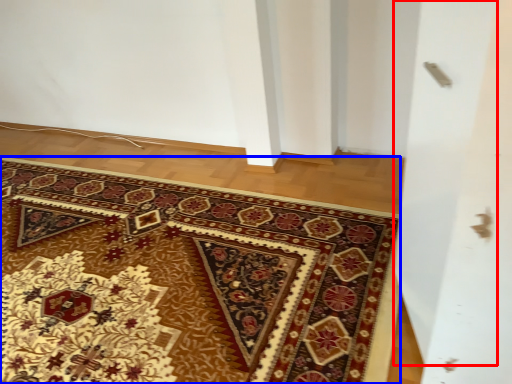
Question: Which point is further to the camera, screen door (highlighted by a red box) or mat (highlighted by a blue box)?

Choices:
 (A) screen door
 (B) mat

Answer: (B)